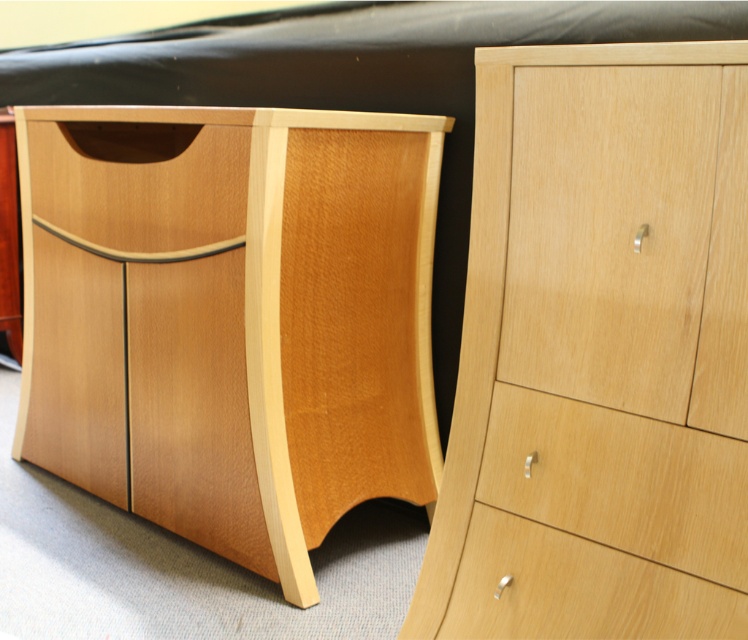
Question: Is light brown wood drawer at center right bigger than light wood drawer at center?

Choices:
 (A) yes
 (B) no

Answer: (B)

Question: Which of the following is the closest to the observer?

Choices:
 (A) light wood drawer at center
 (B) light brown wood drawer at center right

Answer: (B)

Question: Which point is farther to the camera?

Choices:
 (A) (545, 554)
 (B) (646, 456)

Answer: (A)

Question: Does light brown wood drawer at center right have a greater width compared to light wood drawer at center?

Choices:
 (A) no
 (B) yes

Answer: (A)

Question: Can you confirm if light brown wood drawer at center right is smaller than light wood drawer at center?

Choices:
 (A) no
 (B) yes

Answer: (B)